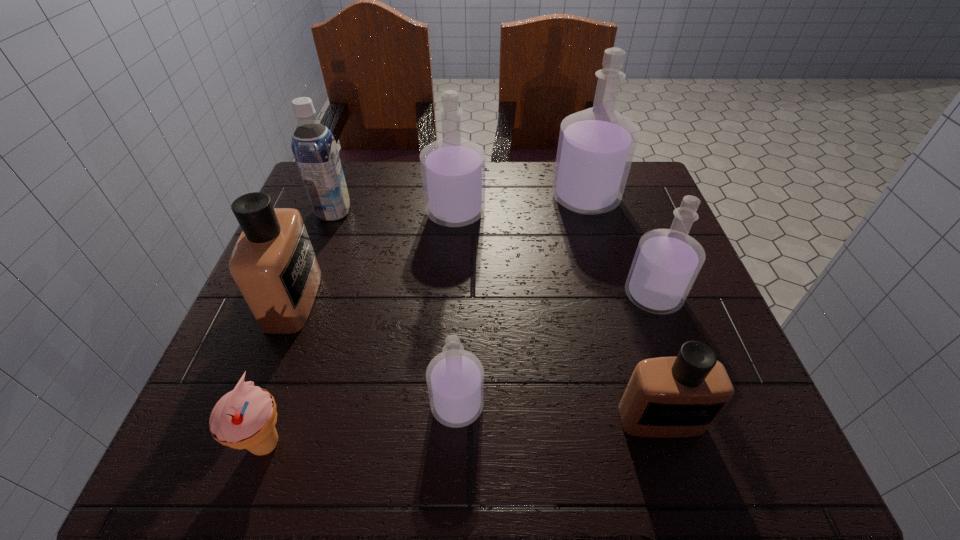
Where is `vacant area at the right edge`? vacant area at the right edge is located at coordinates (670, 220).

This screenshot has width=960, height=540. In order to click on vacant point at the far right corner in this screenshot , I will do `click(658, 195)`.

Where is `unoccupied position between the smallest purple perfume and the left beige perfume`? unoccupied position between the smallest purple perfume and the left beige perfume is located at coordinates (375, 352).

Find the location of a particular element. The image size is (960, 540). free space between the second biggest purple perfume and the biggest purple perfume is located at coordinates (520, 205).

The image size is (960, 540). Identify the location of free spot between the icecream and the tallest perfume. (425, 321).

Where is `free space between the soya milk and the right beige perfume`? free space between the soya milk and the right beige perfume is located at coordinates (497, 315).

The image size is (960, 540). What are the coordinates of `vacant area between the right beige perfume and the second nearest purple perfume` in the screenshot? It's located at (657, 357).

Locate an element on the screen. Image resolution: width=960 pixels, height=540 pixels. free space between the third farthest purple perfume and the nearer beige perfume is located at coordinates (657, 357).

Where is `unoccupied position between the nearest purple perfume and the tallest perfume`? This screenshot has height=540, width=960. unoccupied position between the nearest purple perfume and the tallest perfume is located at coordinates (521, 301).

The image size is (960, 540). In order to click on vacant space that is in between the icecream and the biggest purple perfume in this screenshot , I will do `click(425, 321)`.